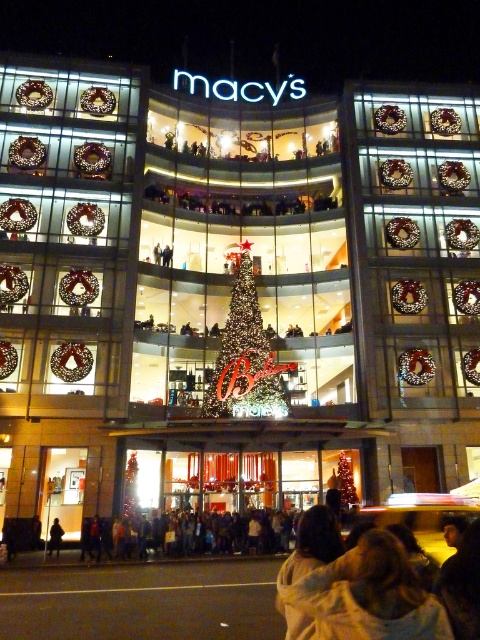
Question: From the image, what is the correct spatial relationship of illuminated glass christmas tree at center in relation to dark brown leather jacket at lower left?

Choices:
 (A) below
 (B) above

Answer: (B)

Question: Which point is closer to the camera?

Choices:
 (A) (264, 365)
 (B) (49, 529)

Answer: (B)

Question: Does illuminated glass christmas tree at center appear on the left side of dark brown leather jacket at lower left?

Choices:
 (A) yes
 (B) no

Answer: (B)

Question: Among these points, which one is farthest from the camera?

Choices:
 (A) (216, 365)
 (B) (57, 531)

Answer: (A)

Question: Which point is farther from the camera taking this photo?

Choices:
 (A) (49, 528)
 (B) (252, 396)

Answer: (B)

Question: Is illuminated glass christmas tree at center to the left of dark brown leather jacket at lower left from the viewer's perspective?

Choices:
 (A) no
 (B) yes

Answer: (A)